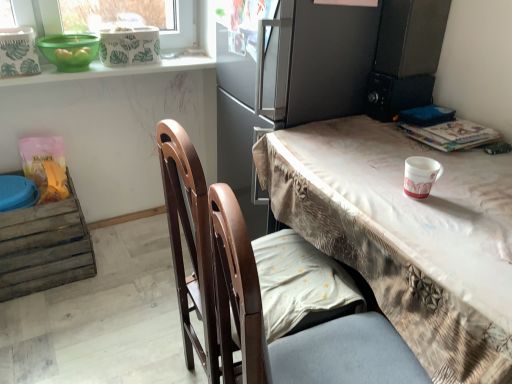
The image size is (512, 384). Find the location of `vacant area that is in front of white paper cup at right`. vacant area that is in front of white paper cup at right is located at coordinates (438, 224).